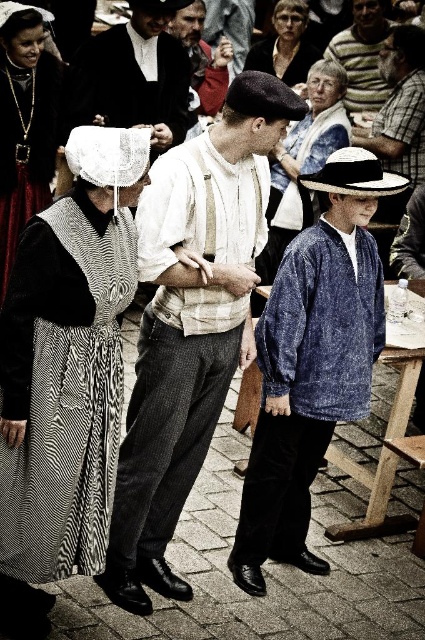
Consider the image. Between velvet black dress at left and white straw hat at center, which one is positioned higher?

white straw hat at center is above.

You are a GUI agent. You are given a task and a screenshot of the screen. Output one action in this format:
    pyautogui.click(x=<x>, y=<y>)
    Task: Click on the velvet black dress at left
    The width and height of the screenshot is (425, 640).
    Given the screenshot: What is the action you would take?
    pyautogui.click(x=70, y=413)

Between point (311, 556) and point (79, 124), which one is positioned in front?

Point (311, 556)

Is point (354, 301) closer to viewer compared to point (112, 49)?

Yes, point (354, 301) is in front of point (112, 49).

Does point (280, 378) come farther from viewer compared to point (107, 99)?

No, it is not.

At what (x,y) coordinates should I click in order to perform the action: click on denim shirt at center. Please return your answer as a coordinate pair (x, y). This screenshot has width=425, height=640. Looking at the image, I should click on (312, 362).

Is matte white shirt at center taller than velvet black dress at left?

Correct, matte white shirt at center is much taller as velvet black dress at left.

Is point (294, 109) positioned in front of point (5, 388)?

No, (294, 109) is behind (5, 388).

The height and width of the screenshot is (640, 425). What are the coordinates of `matte white shirt at center` in the screenshot? It's located at (190, 324).